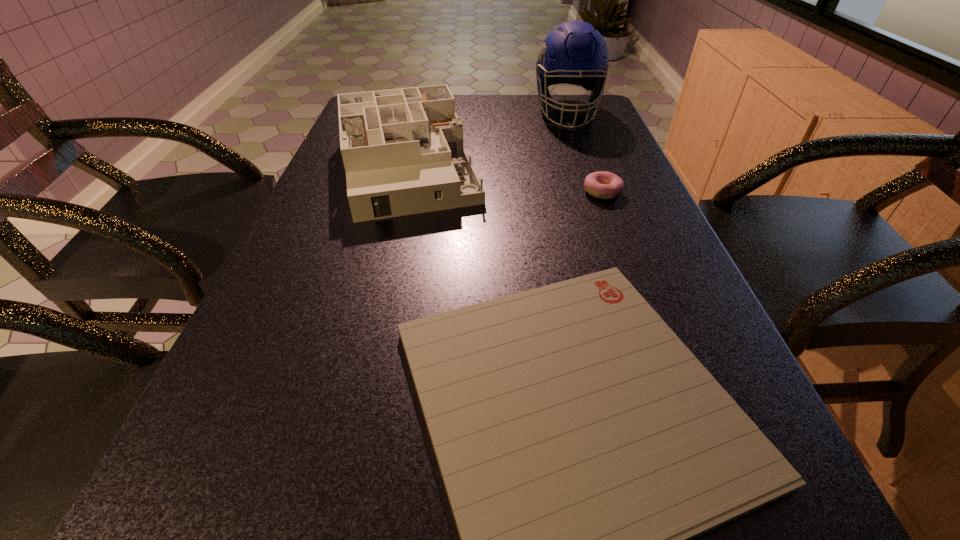
Where is `football helmet`? football helmet is located at coordinates (575, 53).

Locate an element on the screen. dollhouse is located at coordinates (403, 153).

Where is `doughnut`? This screenshot has height=540, width=960. doughnut is located at coordinates (604, 185).

Locate an element on the screen. The height and width of the screenshot is (540, 960). vacant space located 0.300m on the front-facing side of the tallest object is located at coordinates (593, 188).

Find the location of a particular element. free location located on the front of the second tallest object is located at coordinates (389, 249).

At what (x,y) coordinates should I click in order to perform the action: click on vacant space located 0.120m on the front of the doughnut. Please return your answer as a coordinate pair (x, y). This screenshot has width=960, height=540. Looking at the image, I should click on (618, 235).

At what (x,y) coordinates should I click in order to perform the action: click on object that is positioned at the far edge. Please return your answer as a coordinate pair (x, y). This screenshot has height=540, width=960. Looking at the image, I should click on (575, 53).

This screenshot has width=960, height=540. What are the coordinates of `object at the left edge` in the screenshot? It's located at (403, 153).

The width and height of the screenshot is (960, 540). Find the location of `football helmet present at the right edge`. football helmet present at the right edge is located at coordinates (575, 53).

Locate an element on the screen. doughnut located in the right edge section of the desktop is located at coordinates (604, 185).